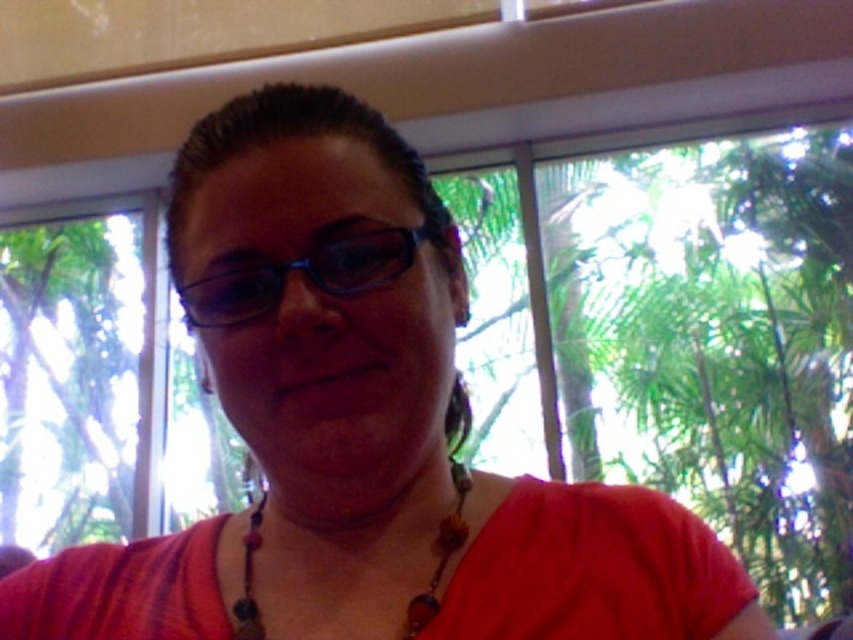
You are standing in the room and want to place a 15 inch wide book on the table in front of the transparent plastic glasses at center. Can the book fit on the table without overlapping the glasses?

The transparent plastic glasses at center and viewer are 15.19 inches apart from each other. Since the book is 15 inches wide, it can fit on the table without overlapping the glasses as there is enough space between them.

You are a fashion designer observing the image. You want to create a new accessory that complements both the transparent plastic glasses at center and the beaded necklace at center. Considering their sizes, which accessory should you focus on making larger to maintain visual balance?

The transparent plastic glasses at center is larger in size than beaded necklace at center, so to maintain visual balance, the accessory paired with the beaded necklace at center should be made larger.

Looking at this image, you are taking a photo of the person in the scene. The camera is positioned at the same level as the person. You want to focus on the point closer to the camera between point [392,259] and point [463,520]. Which point should you focus on?

You should focus on point [392,259] because it is closer to the camera than point [463,520].